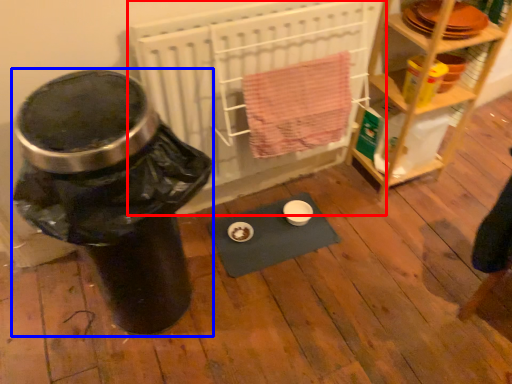
Question: Which object appears farthest to the camera in this image, wide (highlighted by a red box) or water cooler (highlighted by a blue box)?

Choices:
 (A) wide
 (B) water cooler

Answer: (A)